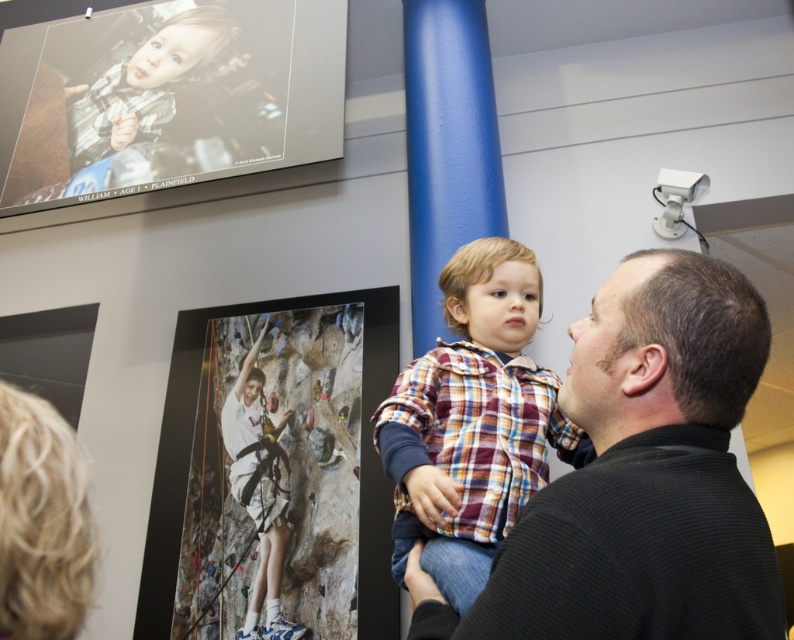
Question: Is plaid fabric shirt at center below white cotton shirt at upper center?

Choices:
 (A) yes
 (B) no

Answer: (B)

Question: Which of the following is the closest to the observer?

Choices:
 (A) white fabric climbing harness at center
 (B) white cotton shirt at upper center
 (C) black textured shirt at center

Answer: (C)

Question: From the image, what is the correct spatial relationship of white fabric climbing harness at center in relation to plaid fabric shirt at center?

Choices:
 (A) left
 (B) right

Answer: (A)

Question: Is white fabric climbing harness at center closer to camera compared to white cotton shirt at upper center?

Choices:
 (A) no
 (B) yes

Answer: (B)

Question: Which of the following is the closest to the observer?

Choices:
 (A) black textured shirt at center
 (B) plaid fabric shirt at center
 (C) white fabric climbing harness at center
 (D) white cotton shirt at upper center

Answer: (A)

Question: Which object appears closest to the camera in this image?

Choices:
 (A) white cotton shirt at upper center
 (B) plaid fabric shirt at center
 (C) black textured shirt at center

Answer: (C)